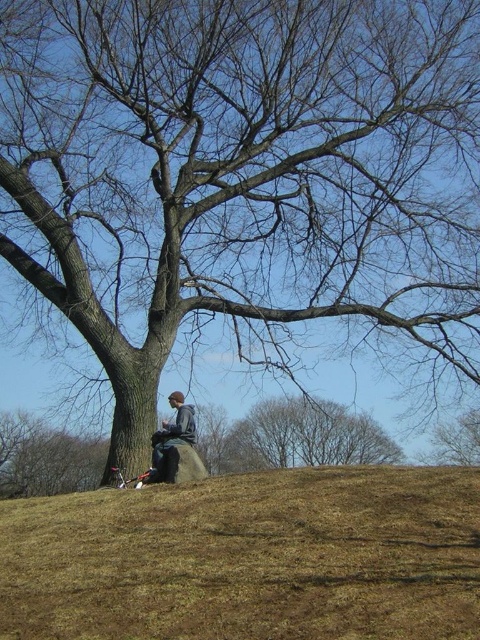
Between brown rough tree at center and gray fleece jacket at center, which one appears on the right side from the viewer's perspective?

brown rough tree at center

Does brown rough tree at center appear on the left side of gray fleece jacket at center?

Incorrect, brown rough tree at center is not on the left side of gray fleece jacket at center.

The image size is (480, 640). What are the coordinates of `brown rough tree at center` in the screenshot? It's located at (303, 436).

Identify the location of brown rough tree at center. The image size is (480, 640). (303, 436).

Who is more forward, (374, 444) or (439, 445)?

Positioned in front is point (439, 445).

Can you confirm if brown rough tree at center is taller than brown leafless tree at upper center?

Yes.

Locate an element on the screen. brown rough tree at center is located at coordinates (303, 436).

Which is more to the right, brown leafless tree at upper center or gray fleece jacket at center?

brown leafless tree at upper center is more to the right.

Does brown leafless tree at upper center have a greater width compared to gray fleece jacket at center?

Yes.

Locate an element on the screen. The height and width of the screenshot is (640, 480). brown leafless tree at upper center is located at coordinates (456, 440).

Identify the location of brown leafless tree at upper center. Image resolution: width=480 pixels, height=640 pixels. (456, 440).